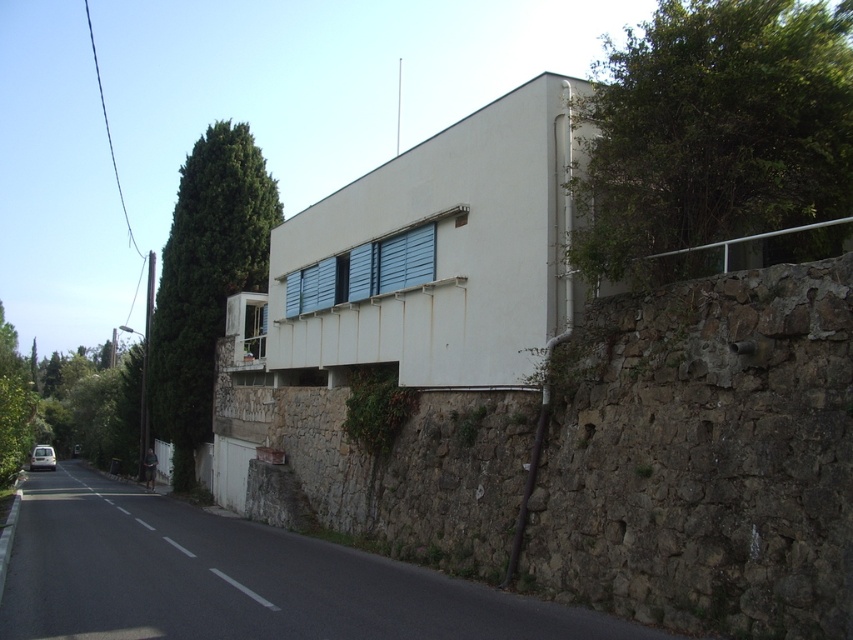
Measure the distance between white stone wall at center and blue matte window at center.

white stone wall at center is 15.32 feet away from blue matte window at center.

Can you confirm if white stone wall at center is smaller than blue matte window at center?

Actually, white stone wall at center might be larger than blue matte window at center.

What do you see at coordinates (704, 458) in the screenshot?
I see `white stone wall at center` at bounding box center [704, 458].

Locate an element on the screen. This screenshot has height=640, width=853. white stone wall at center is located at coordinates (704, 458).

Looking at this image, which of these two, blue matte window at center or white matte van at lower left, stands shorter?

With less height is blue matte window at center.

Between point (405, 285) and point (30, 468), which one is positioned in front?

Point (405, 285) is more forward.

In order to click on blue matte window at center in this screenshot , I will do `click(363, 272)`.

Which is behind, point (801, 512) or point (235, 138)?

The point (235, 138) is more distant.

Does point (332, 406) come farther from viewer compared to point (212, 333)?

No, it is in front of (212, 333).

This screenshot has width=853, height=640. I want to click on white stone wall at center, so click(704, 458).